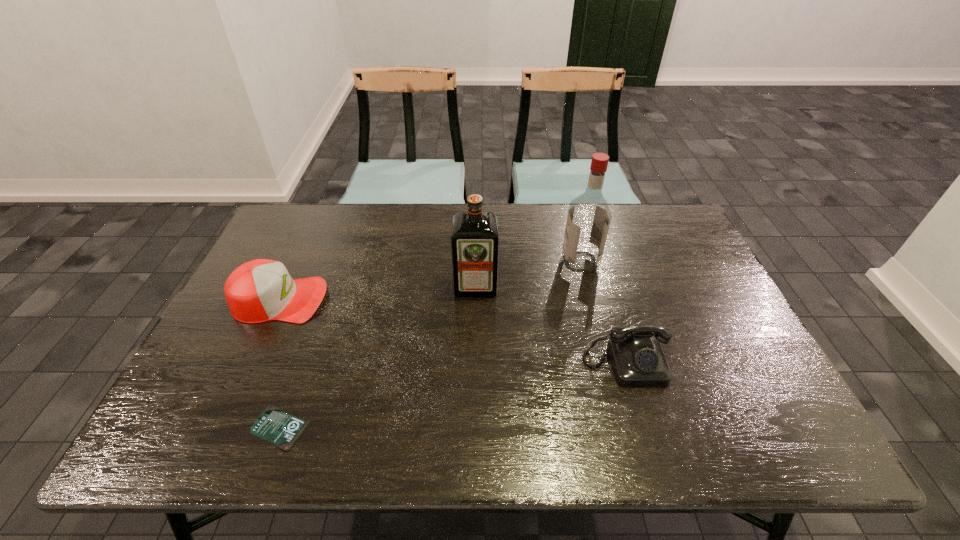
This screenshot has width=960, height=540. What are the coordinates of `the farthest object` in the screenshot? It's located at (589, 216).

Locate an element on the screen. the right liquor is located at coordinates (589, 216).

Where is `the shorter liquor`? Image resolution: width=960 pixels, height=540 pixels. the shorter liquor is located at coordinates (474, 240).

Identify the location of the fourth shortest object. (474, 240).

Where is `baseball cap`? This screenshot has width=960, height=540. baseball cap is located at coordinates (261, 290).

Find the location of a particular element. This screenshot has height=540, width=960. the fourth tallest object is located at coordinates (637, 357).

Identify the location of the fourth farthest object. (637, 357).

Identify the location of identity card. (274, 425).

The image size is (960, 540). What are the coordinates of `the shortest object` in the screenshot? It's located at coord(274,425).

This screenshot has height=540, width=960. Identify the location of vacant position located on the front-facing side of the farthest object. (504, 261).